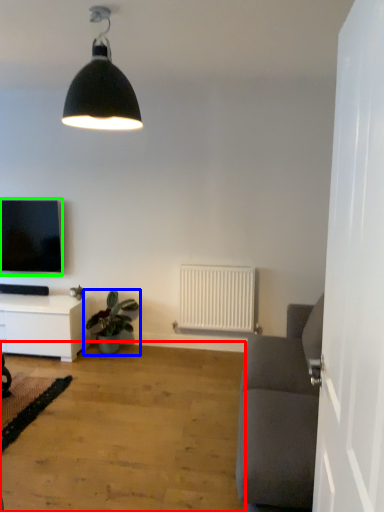
Question: Which object is the closest to the plain (highlighted by a red box)? Choose among these: houseplant (highlighted by a blue box) or television (highlighted by a green box).

Choices:
 (A) houseplant
 (B) television

Answer: (A)